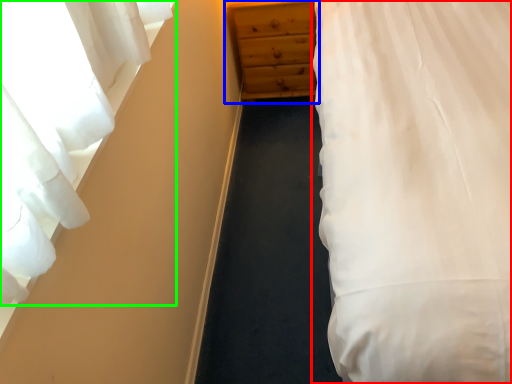
Question: Which object is the closest to the bed (highlighted by a red box)? Choose among these: chest of drawers (highlighted by a blue box) or curtain (highlighted by a green box).

Choices:
 (A) chest of drawers
 (B) curtain

Answer: (B)